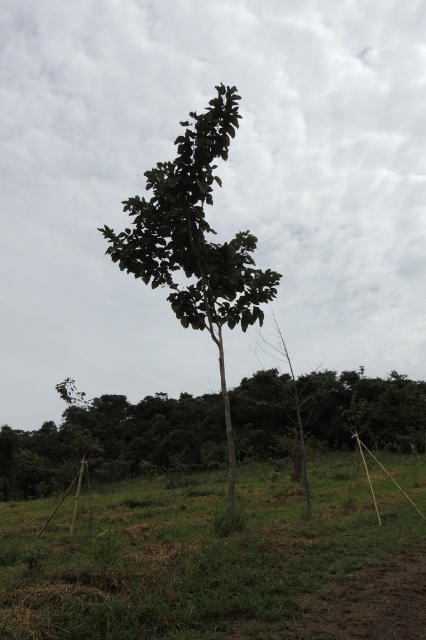
Where is `green grass at center`? green grass at center is located at coordinates (218, 563).

Where is `green grass at center`? This screenshot has height=640, width=426. green grass at center is located at coordinates (218, 563).

Between green leafy tree at lower left and green leafy tree at center, which one is positioned lower?

Positioned lower is green leafy tree at lower left.

How much distance is there between green leafy tree at lower left and green leafy tree at center?

A distance of 15.77 meters exists between green leafy tree at lower left and green leafy tree at center.

Which is behind, point (423, 388) or point (178, 147)?

Point (423, 388)

Find the location of a particular element. This screenshot has width=426, height=640. green leafy tree at lower left is located at coordinates (112, 442).

Who is taller, green grass at center or green leafy tree at center?

green leafy tree at center is taller.

Is point (158, 563) positioned after point (192, 129)?

No, (158, 563) is in front of (192, 129).

What are the coordinates of `green grass at center` in the screenshot? It's located at (218, 563).